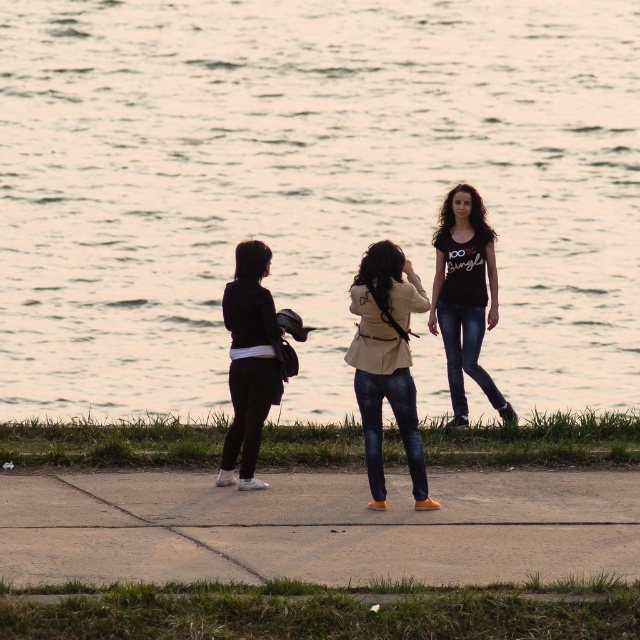
Between point (212, 388) and point (460, 388), which one is positioned in front?

Point (460, 388)

Which is more to the left, shiny silver water at center or jeans at center?

shiny silver water at center is more to the left.

Is point (372, 205) positioned in front of point (452, 342)?

That is False.

What are the coordinates of `shiny silver water at center` in the screenshot? It's located at (307, 188).

Looking at this image, which is above, concrete at center or jeans at center?

Positioned higher is jeans at center.

Who is more forward, (582,529) or (452,365)?

Point (582,529) is in front.

You are a GUI agent. You are given a task and a screenshot of the screen. Output one action in this format:
    pyautogui.click(x=<x>, y=<y>)
    Task: Click on the concrete at center
    The width and height of the screenshot is (640, 640).
    Given the screenshot: What is the action you would take?
    pyautogui.click(x=316, y=528)

Does black matte jacket at center have a lesser height compared to dark blue denim jeans at center?

Incorrect, black matte jacket at center's height does not fall short of dark blue denim jeans at center's.

Which of these two, black matte jacket at center or dark blue denim jeans at center, stands taller?

black matte jacket at center

The height and width of the screenshot is (640, 640). Describe the element at coordinates (250, 362) in the screenshot. I see `black matte jacket at center` at that location.

I want to click on black matte jacket at center, so click(x=250, y=362).